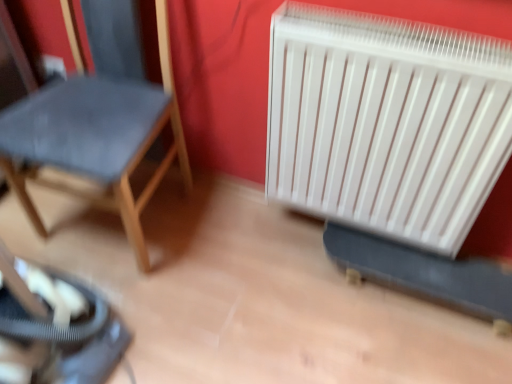
Identify the location of free space in front of velvet blue chair at left. (168, 307).